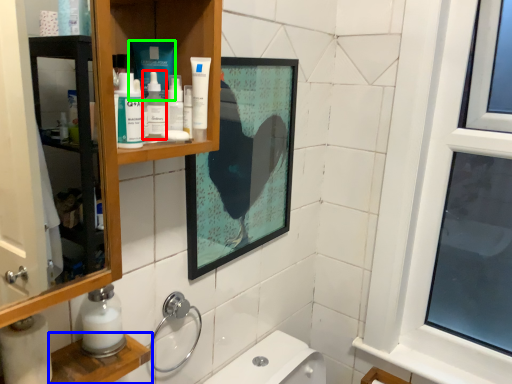
Question: Based on their relative distances, which object is nearer to mouthwash (highlighted by a red box)? Choose from cabinet (highlighted by a blue box) and product (highlighted by a green box).

Choices:
 (A) cabinet
 (B) product

Answer: (B)